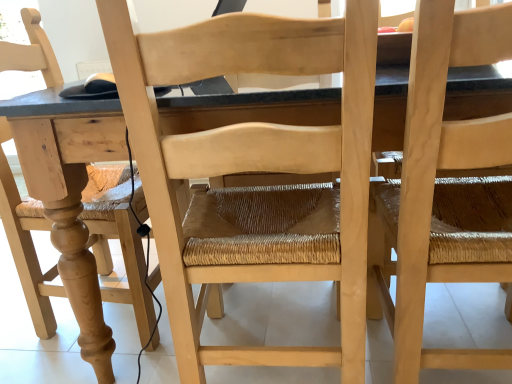
This screenshot has width=512, height=384. What do you see at coordinates (255, 171) in the screenshot? I see `natural wood chair at center, the first chair viewed from the left` at bounding box center [255, 171].

Find the location of a particular element. This screenshot has width=512, height=384. natural wood chair at center, which is the 2th chair from right to left is located at coordinates (255, 171).

Based on the photo, from the image's perspective, who appears lower, natural wood chair at right, positioned as the first chair in right-to-left order, or natural wood chair at center, which is the 2th chair from right to left?

natural wood chair at right, positioned as the first chair in right-to-left order.

Between natural wood chair at right, which is counted as the 2th chair, starting from the left, and natural wood chair at center, which is the 2th chair from right to left, which one is positioned behind?

natural wood chair at center, which is the 2th chair from right to left, is behind.

Would you say natural wood chair at right, positioned as the first chair in right-to-left order, is inside or outside natural wood chair at center, the first chair viewed from the left?

natural wood chair at right, positioned as the first chair in right-to-left order, lies outside natural wood chair at center, the first chair viewed from the left.

From a real-world perspective, who is located lower, natural wood chair at right, which is counted as the 2th chair, starting from the left, or natural wood chair at center, the first chair viewed from the left?

From a 3D spatial view, natural wood chair at right, which is counted as the 2th chair, starting from the left, is below.

Which of these two, natural wood chair at center, the first chair viewed from the left, or natural wood chair at right, which is counted as the 2th chair, starting from the left, is wider?

natural wood chair at center, the first chair viewed from the left, is wider.

Is natural wood chair at right, positioned as the first chair in right-to-left order, inside natural wood chair at center, the first chair viewed from the left?

That's incorrect, natural wood chair at right, positioned as the first chair in right-to-left order, is not inside natural wood chair at center, the first chair viewed from the left.

Considering the sizes of objects natural wood chair at center, the first chair viewed from the left, and natural wood chair at right, which is counted as the 2th chair, starting from the left, in the image provided, who is taller, natural wood chair at center, the first chair viewed from the left, or natural wood chair at right, which is counted as the 2th chair, starting from the left,?

natural wood chair at center, the first chair viewed from the left.

Is natural wood chair at center, the first chair viewed from the left, not near natural wood chair at right, positioned as the first chair in right-to-left order?

Actually, natural wood chair at center, the first chair viewed from the left, and natural wood chair at right, positioned as the first chair in right-to-left order, are a little close together.

In the scene shown: Is natural wood table at center inside the boundaries of natural wood chair at right, positioned as the first chair in right-to-left order, or outside?

natural wood table at center exists outside the volume of natural wood chair at right, positioned as the first chair in right-to-left order.

Considering the sizes of natural wood table at center and natural wood chair at right, positioned as the first chair in right-to-left order, in the image, is natural wood table at center wider or thinner than natural wood chair at right, positioned as the first chair in right-to-left order,?

natural wood table at center is wider than natural wood chair at right, positioned as the first chair in right-to-left order.

At what (x,y) coordinates should I click in order to perform the action: click on table above the natural wood chair at right, which is counted as the 2th chair, starting from the left (from the image's perspective). Please return your answer as a coordinate pair (x, y). Looking at the image, I should click on (250, 109).

From a real-world perspective, which is physically below, natural wood table at center or natural wood chair at right, which is counted as the 2th chair, starting from the left?

natural wood table at center.

Between point (217, 101) and point (169, 301), which one is positioned behind?

Positioned behind is point (169, 301).

Is natural wood table at center touching natural wood chair at center, the first chair viewed from the left?

They are not placed beside each other.

From the image's perspective, who appears lower, natural wood table at center or natural wood chair at center, which is the 2th chair from right to left?

From the image's view, natural wood chair at center, which is the 2th chair from right to left, is below.

How many degrees apart are the facing directions of natural wood table at center and natural wood chair at center, the first chair viewed from the left?

The angle between the facing direction of natural wood table at center and the facing direction of natural wood chair at center, the first chair viewed from the left, is 88 degrees.

Is natural wood chair at right, positioned as the first chair in right-to-left order, taller than natural wood table at center?

Correct, natural wood chair at right, positioned as the first chair in right-to-left order, is much taller as natural wood table at center.

From a real-world perspective, is natural wood chair at right, positioned as the first chair in right-to-left order, located higher than natural wood table at center?

Yes.

Considering the points (481, 127) and (408, 67), which point is in front, point (481, 127) or point (408, 67)?

The point (481, 127) is closer.

From the image's perspective, relative to natural wood table at center, is natural wood chair at center, the first chair viewed from the left, above or below?

From the image's perspective, natural wood chair at center, the first chair viewed from the left, appears below natural wood table at center.

Is natural wood chair at center, which is the 2th chair from right to left, positioned with its back to natural wood table at center?

That's right, natural wood chair at center, which is the 2th chair from right to left, is facing away from natural wood table at center.

From a real-world perspective, is natural wood chair at center, the first chair viewed from the left, positioned over natural wood table at center based on gravity?

Yes, from a real-world perspective, natural wood chair at center, the first chair viewed from the left, is above natural wood table at center.

Between natural wood chair at center, the first chair viewed from the left, and natural wood table at center, which one has more height?

natural wood chair at center, the first chair viewed from the left.

The height and width of the screenshot is (384, 512). Find the location of `chair behind the natural wood chair at right, which is counted as the 2th chair, starting from the left`. chair behind the natural wood chair at right, which is counted as the 2th chair, starting from the left is located at coordinates (255, 171).

There is a natural wood chair at right, which is counted as the 2th chair, starting from the left. Where is `chair above it (from a real-world perspective)`? The width and height of the screenshot is (512, 384). chair above it (from a real-world perspective) is located at coordinates (255, 171).

Looking at the image, which one is located closer to natural wood chair at right, positioned as the first chair in right-to-left order, natural wood chair at center, which is the 2th chair from right to left, or natural wood table at center?

natural wood chair at center, which is the 2th chair from right to left.

Which object lies nearer to the anchor point natural wood table at center, natural wood chair at center, which is the 2th chair from right to left, or natural wood chair at right, which is counted as the 2th chair, starting from the left?

natural wood chair at center, which is the 2th chair from right to left, is closer to natural wood table at center.

When comparing their distances from natural wood table at center, does natural wood chair at right, positioned as the first chair in right-to-left order, or natural wood chair at center, the first chair viewed from the left, seem further?

natural wood chair at right, positioned as the first chair in right-to-left order.

When comparing their distances from natural wood chair at right, which is counted as the 2th chair, starting from the left, does natural wood table at center or natural wood chair at center, which is the 2th chair from right to left, seem further?

natural wood table at center is further to natural wood chair at right, which is counted as the 2th chair, starting from the left.

Which object lies further to the anchor point natural wood chair at center, the first chair viewed from the left, natural wood table at center or natural wood chair at right, which is counted as the 2th chair, starting from the left?

Based on the image, natural wood chair at right, which is counted as the 2th chair, starting from the left, appears to be further to natural wood chair at center, the first chair viewed from the left.

Looking at the image, which one is located further to natural wood chair at center, which is the 2th chair from right to left, natural wood chair at right, positioned as the first chair in right-to-left order, or natural wood table at center?

The object further to natural wood chair at center, which is the 2th chair from right to left, is natural wood chair at right, positioned as the first chair in right-to-left order.

Identify the location of table situated between natural wood chair at center, the first chair viewed from the left, and natural wood chair at right, which is counted as the 2th chair, starting from the left, from left to right. (250, 109).